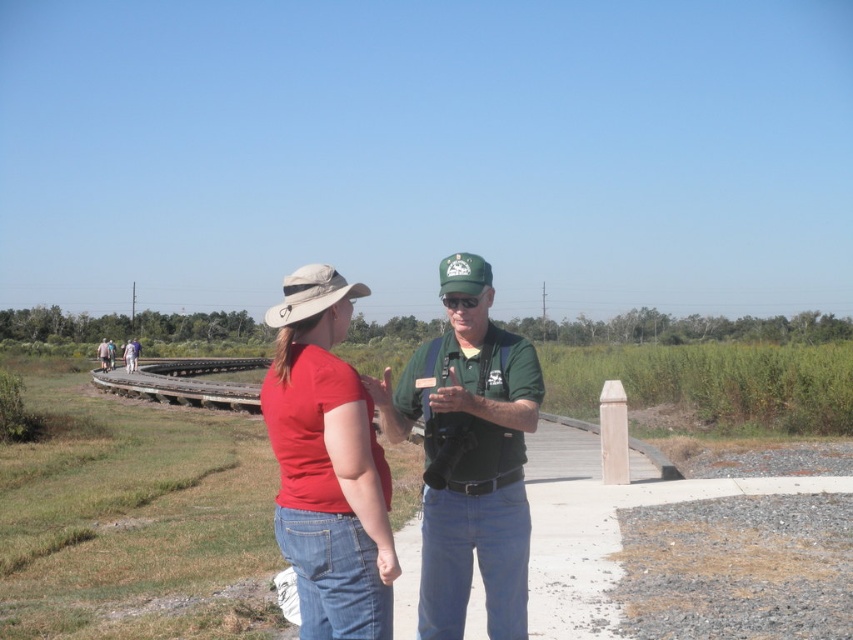
You are standing on the boardwalk and want to take a photo of the khaki fabric baseball hat at center and the matte red shirt at left. Which object should you focus on first if you want to capture both in sharp focus?

The khaki fabric baseball hat at center is closer to the viewer than the matte red shirt at left, so you should focus on the khaki fabric baseball hat at center first to ensure both are in sharp focus.

You are standing at the origin point of the boardwalk and want to find the green fabric baseball cap at center. According to the coordinate system where the boardwalk starts at the origin, which direction should you walk to reach it?

The green fabric baseball cap at center is located at coordinate point (x=463, y=273). Since the x and y coordinates are both positive, you should walk northeast to reach it.